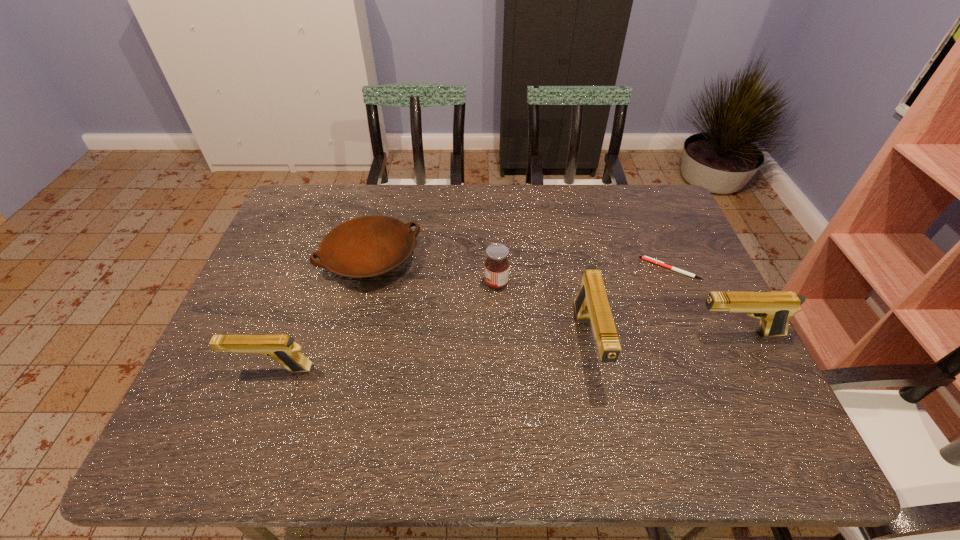
At what (x,y) coordinates should I click in order to perform the action: click on blank space located 0.160m on the back of the fifth tallest object. Please return your answer as a coordinate pair (x, y). The width and height of the screenshot is (960, 540). Looking at the image, I should click on (386, 198).

Identify the location of vacant space located on the label side of the jam. (437, 283).

Locate an element on the screen. This screenshot has height=540, width=960. free space located on the label side of the jam is located at coordinates (356, 283).

Where is `blank space located on the label side of the jam`? This screenshot has width=960, height=540. blank space located on the label side of the jam is located at coordinates (411, 283).

Locate an element on the screen. This screenshot has height=540, width=960. vacant space situated on the clicker of the shortest object is located at coordinates (589, 269).

I want to click on blank space located on the clicker of the shortest object, so click(x=536, y=269).

Identify the location of vacant point located on the clicker of the shortest object. (550, 269).

Where is `object that is at the far edge`? object that is at the far edge is located at coordinates (369, 246).

The height and width of the screenshot is (540, 960). Identify the location of object that is at the near edge. (591, 304).

Identify the location of object that is positioned at the left edge. (282, 348).